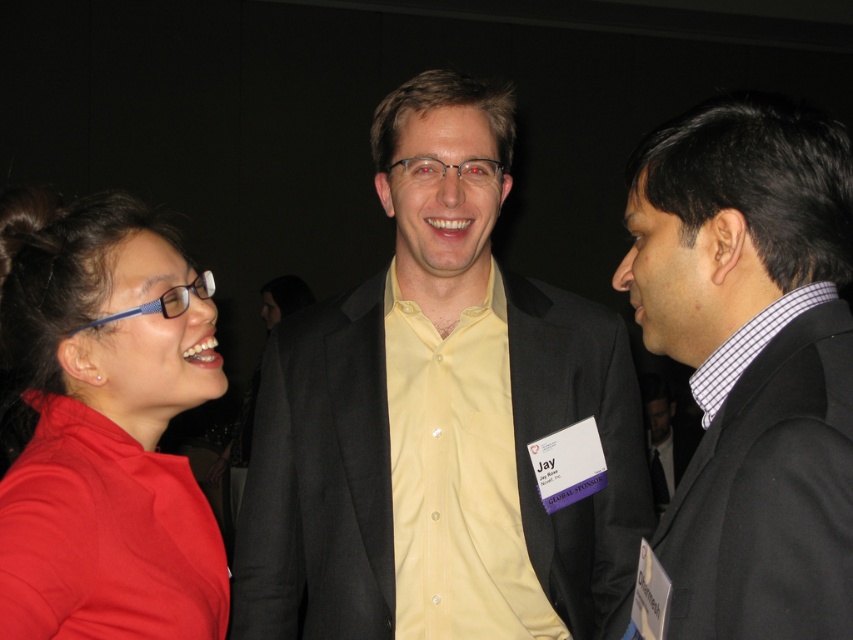
Does yellow matte shirt at center come behind yellow smooth shirt at center?

That is False.

Between yellow matte shirt at center and yellow smooth shirt at center, which one has more height?

yellow matte shirt at center is taller.

Who is more forward, (462, 339) or (409, 616)?

Point (409, 616) is in front.

I want to click on yellow matte shirt at center, so click(x=439, y=420).

Who is positioned more to the left, matte black suit at right or yellow smooth shirt at center?

yellow smooth shirt at center is more to the left.

Is matte black suit at right shorter than yellow smooth shirt at center?

Correct, matte black suit at right is not as tall as yellow smooth shirt at center.

Does point (701, 499) come farther from viewer compared to point (465, 557)?

No, (701, 499) is in front of (465, 557).

You are a GUI agent. You are given a task and a screenshot of the screen. Output one action in this format:
    pyautogui.click(x=<x>, y=<y>)
    Task: Click on the matte black suit at right
    This screenshot has height=640, width=853.
    Given the screenshot: What is the action you would take?
    pyautogui.click(x=752, y=358)

Can you confirm if matte red shirt at left is positioned to the right of yellow smooth shirt at center?

No, matte red shirt at left is not to the right of yellow smooth shirt at center.

Is point (122, 538) more distant than point (454, 540)?

No, it is not.

I want to click on matte red shirt at left, so click(x=103, y=426).